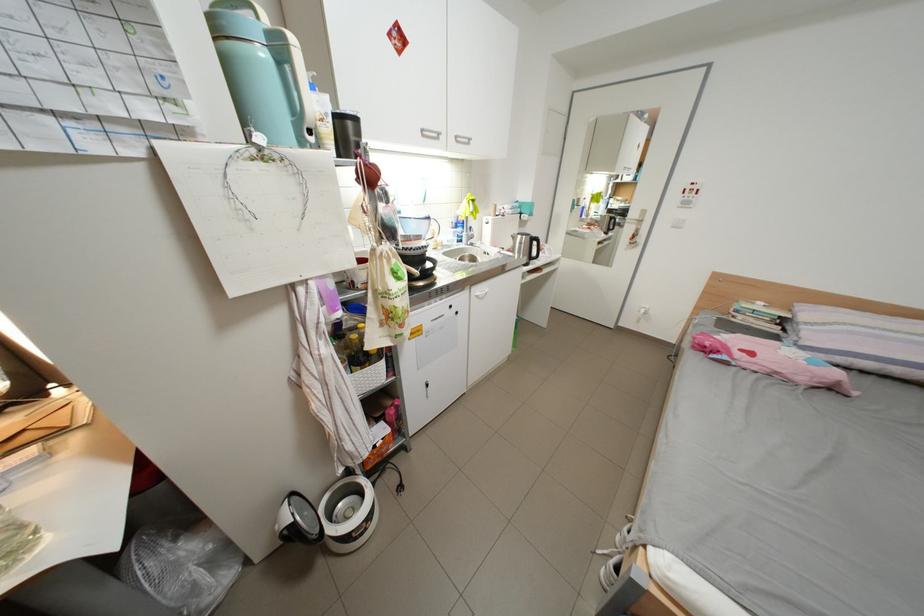
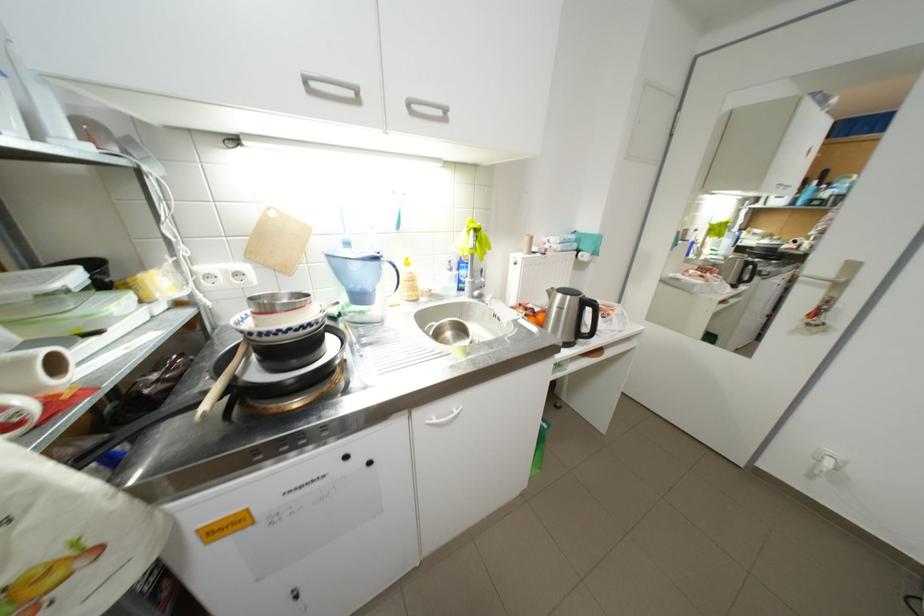
The point at (469, 243) is marked in the first image. Where is the corresponding point in the second image?

(471, 291)